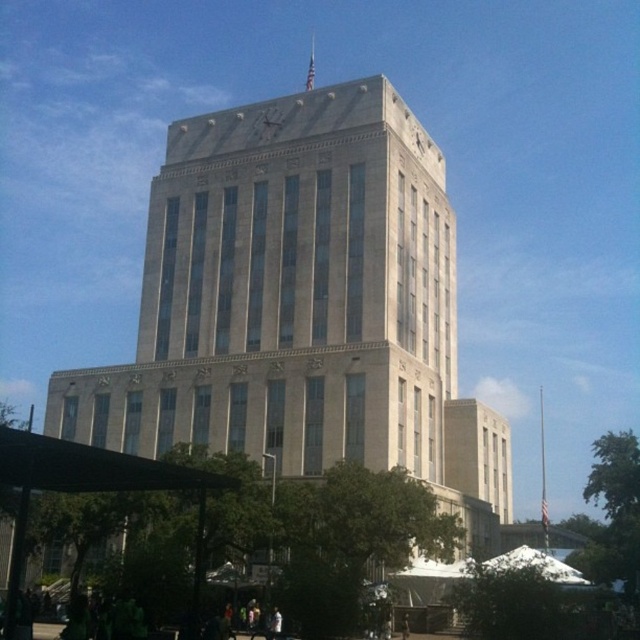
Question: Which point is farther to the camera?

Choices:
 (A) beige stone tower at center
 (B) white fabric canopy at lower center

Answer: (A)

Question: Which of the following is the farthest from the observer?

Choices:
 (A) beige stone tower at center
 (B) white fabric canopy at lower center

Answer: (A)

Question: Which of the following is the farthest from the observer?

Choices:
 (A) white fabric canopy at lower center
 (B) beige stone tower at center

Answer: (B)

Question: Does beige stone tower at center appear on the left side of white fabric canopy at lower center?

Choices:
 (A) no
 (B) yes

Answer: (B)

Question: Is beige stone tower at center closer to the viewer compared to white fabric canopy at lower center?

Choices:
 (A) no
 (B) yes

Answer: (A)

Question: In this image, where is beige stone tower at center located relative to white fabric canopy at lower center?

Choices:
 (A) below
 (B) above

Answer: (B)